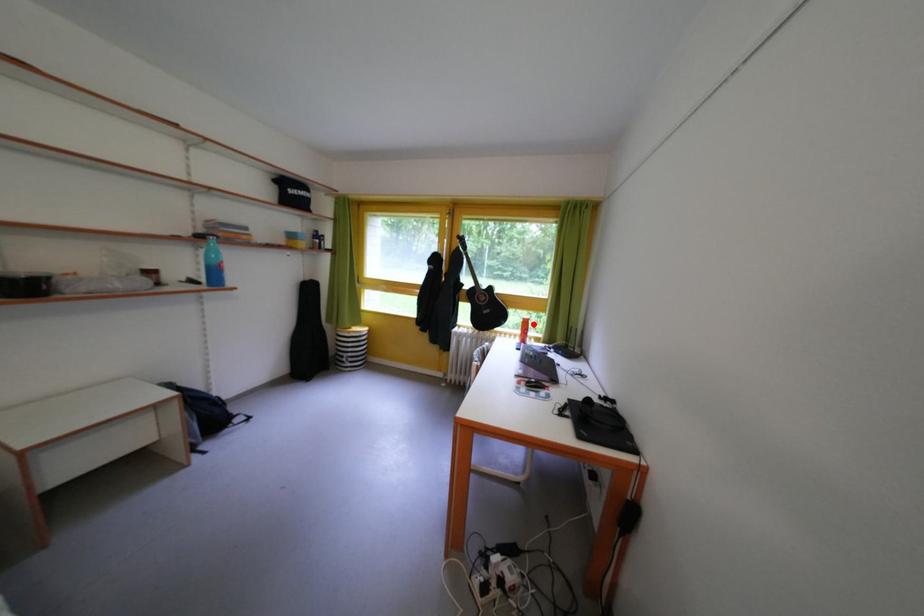
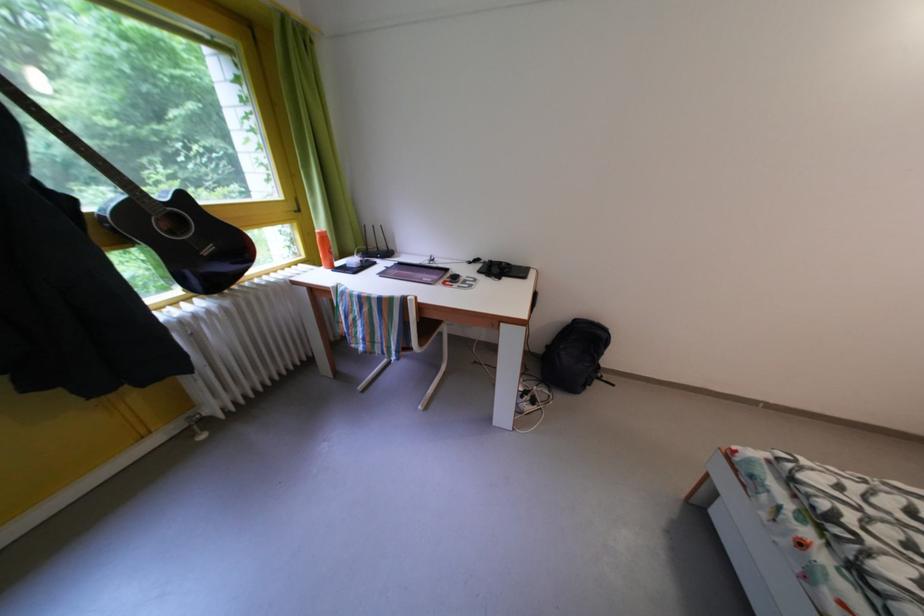
Question: I am providing you with two images of the same scene from different viewpoints. A red point is shown in image1. For the corresponding object point in image2, is it positioned nearer or farther from the camera?

Choices:
 (A) Nearer
 (B) Farther

Answer: (A)